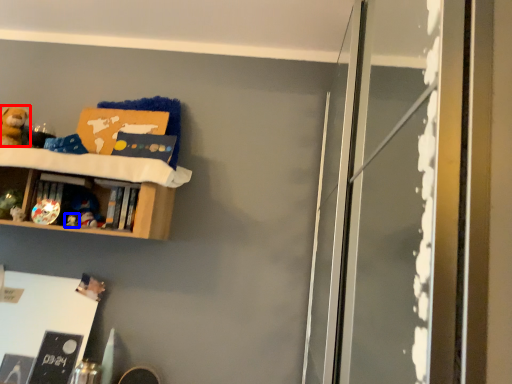
Question: Which object appears farthest to the camera in this image, toy (highlighted by a red box) or toy (highlighted by a blue box)?

Choices:
 (A) toy
 (B) toy

Answer: (B)